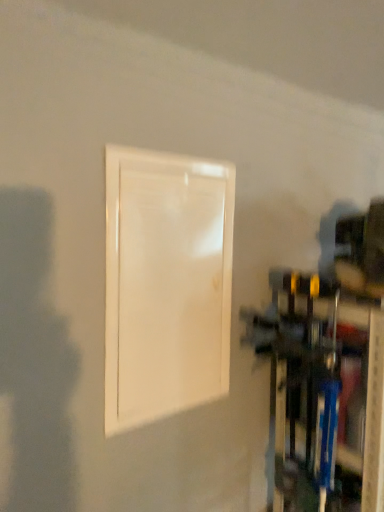
Question: Would you say white glossy door at center is to the left or to the right of blue plastic shelf at lower right in the picture?

Choices:
 (A) left
 (B) right

Answer: (A)

Question: Is point (165, 397) positioned closer to the camera than point (279, 463)?

Choices:
 (A) farther
 (B) closer

Answer: (B)

Question: From a real-world perspective, is white glossy door at center positioned above or below blue plastic shelf at lower right?

Choices:
 (A) below
 (B) above

Answer: (B)

Question: From a real-world perspective, is blue plastic shelf at lower right physically located above or below white glossy door at center?

Choices:
 (A) above
 (B) below

Answer: (B)

Question: Is blue plastic shelf at lower right to the left or to the right of white glossy door at center in the image?

Choices:
 (A) left
 (B) right

Answer: (B)

Question: In terms of width, does blue plastic shelf at lower right look wider or thinner when compared to white glossy door at center?

Choices:
 (A) wide
 (B) thin

Answer: (A)

Question: In terms of height, does blue plastic shelf at lower right look taller or shorter compared to white glossy door at center?

Choices:
 (A) short
 (B) tall

Answer: (B)